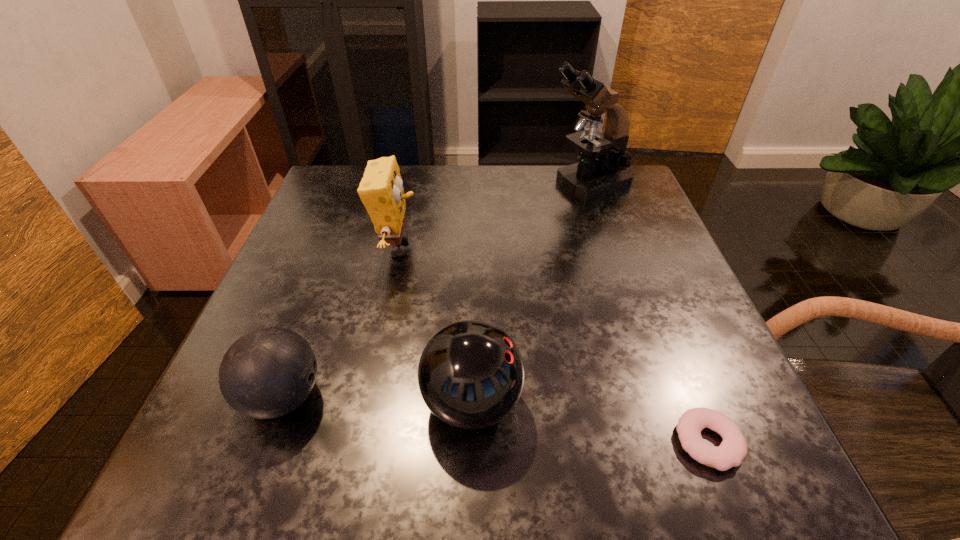
Locate an element on the screen. This screenshot has width=960, height=540. object located at the near right corner is located at coordinates (733, 449).

This screenshot has width=960, height=540. In order to click on blank space at the far edge of the desktop in this screenshot , I will do `click(439, 169)`.

In the image, there is a desktop. Where is `free space at the near edge`? This screenshot has width=960, height=540. free space at the near edge is located at coordinates (383, 434).

This screenshot has width=960, height=540. Find the location of `blank space at the left edge of the desktop`. blank space at the left edge of the desktop is located at coordinates (307, 276).

I want to click on free space at the right edge of the desktop, so click(x=693, y=389).

Locate an element on the screen. The image size is (960, 540). free space at the far left corner of the desktop is located at coordinates (332, 173).

At what (x,y) coordinates should I click in order to perform the action: click on vacant region at the near left corner of the desktop. Please return your answer as a coordinate pair (x, y). The height and width of the screenshot is (540, 960). Looking at the image, I should click on (239, 444).

I want to click on empty space between the tallest object and the shorter bowling ball, so tap(435, 290).

At what (x,y) coordinates should I click in order to perform the action: click on free space that is in between the fourth tallest object and the tallest object. Please return your answer as a coordinate pair (x, y). Looking at the image, I should click on (435, 290).

Where is `vacant region between the third object from right to left and the fourth tallest object`? vacant region between the third object from right to left and the fourth tallest object is located at coordinates (377, 400).